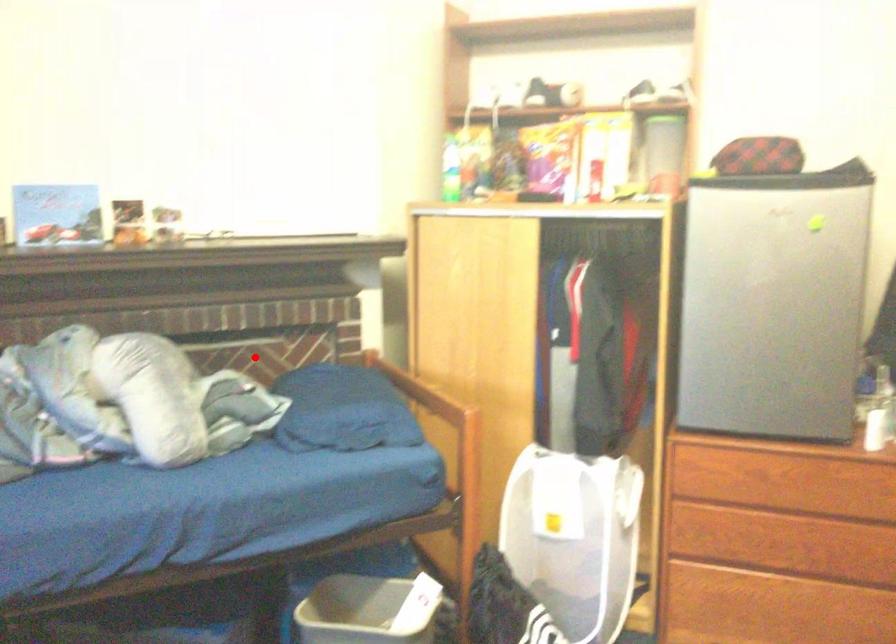
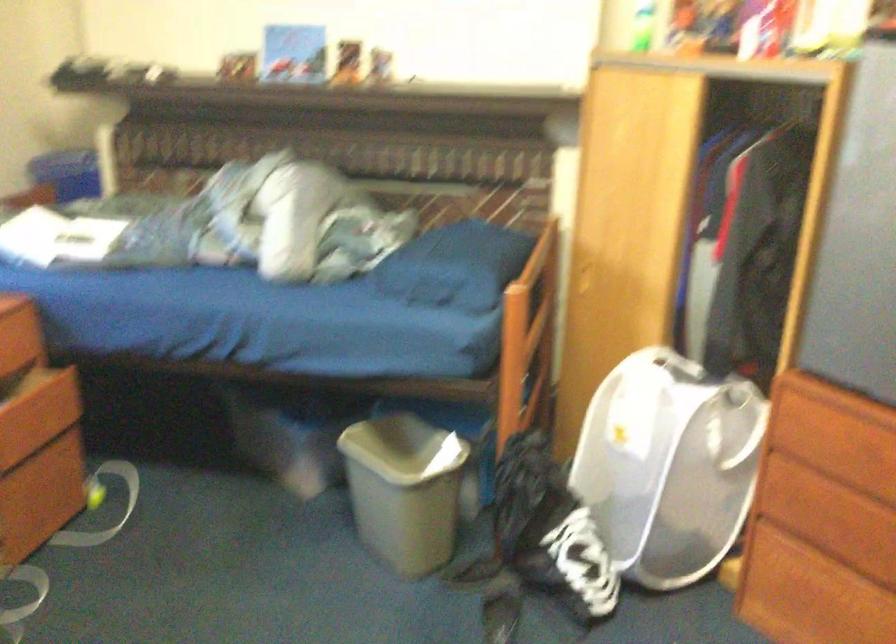
Locate, in the second image, the point that corresponds to the highlighted location in the first image.

(446, 205)